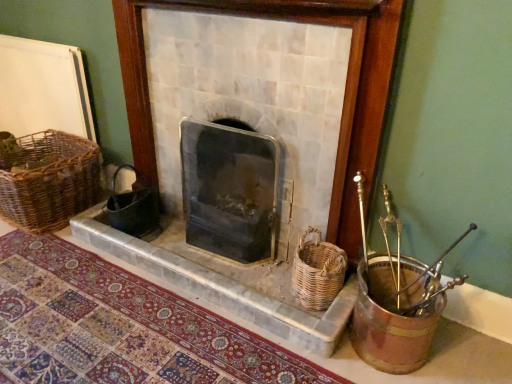
What do you see at coordinates (151, 311) in the screenshot? The height and width of the screenshot is (384, 512). I see `patterned carpet at lower left` at bounding box center [151, 311].

The height and width of the screenshot is (384, 512). What do you see at coordinates (344, 96) in the screenshot?
I see `white marble fireplace at center` at bounding box center [344, 96].

Where is `white marble fireplace at center`? white marble fireplace at center is located at coordinates (344, 96).

The image size is (512, 384). Describe the element at coordinates (229, 191) in the screenshot. I see `black glass wood burning stove at center` at that location.

Locate an element on the screen. Image resolution: width=512 pixels, height=384 pixels. patterned carpet at lower left is located at coordinates (151, 311).

From the image's perspective, which is above, white marble fireplace at center or patterned carpet at lower left?

From the image's view, white marble fireplace at center is above.

Which object is positioned more to the right, white marble fireplace at center or patterned carpet at lower left?

From the viewer's perspective, white marble fireplace at center appears more on the right side.

From a real-world perspective, is white marble fireplace at center positioned under patterned carpet at lower left based on gravity?

No, from a real-world perspective, white marble fireplace at center is not under patterned carpet at lower left.

Considering the sizes of objects white marble fireplace at center and woven brown basket at left, which appears as the 2th basket when viewed from the right, in the image provided, who is thinner, white marble fireplace at center or woven brown basket at left, which appears as the 2th basket when viewed from the right,?

white marble fireplace at center.

Considering the sizes of objects white marble fireplace at center and woven brown basket at left, which appears as the 2th basket when viewed from the right, in the image provided, who is shorter, white marble fireplace at center or woven brown basket at left, which appears as the 2th basket when viewed from the right,?

woven brown basket at left, which appears as the 2th basket when viewed from the right, is shorter.

Is white marble fireplace at center positioned with its back to woven brown basket at left, which appears as the 2th basket when viewed from the right?

No, white marble fireplace at center is not facing the opposite direction of woven brown basket at left, which appears as the 2th basket when viewed from the right.

Looking at this image, does woven brown basket at left, which appears as the 2th basket when viewed from the right, turn towards patterned carpet at lower left?

No, woven brown basket at left, which appears as the 2th basket when viewed from the right, is not oriented towards patterned carpet at lower left.

This screenshot has width=512, height=384. Identify the location of basket that is the 2nd object located above the patterned carpet at lower left (from the image's perspective). (51, 181).

Based on the photo, considering their positions, is woven brown basket at left, marked as the first basket in a back-to-front arrangement, located in front of or behind patterned carpet at lower left?

In the image, woven brown basket at left, marked as the first basket in a back-to-front arrangement, appears behind patterned carpet at lower left.

Which object is further away from the camera taking this photo, white marble fireplace at center or black glass wood burning stove at center?

black glass wood burning stove at center is behind.

From a real-world perspective, is white marble fireplace at center physically located above or below black glass wood burning stove at center?

Clearly, from a real-world perspective, white marble fireplace at center is above black glass wood burning stove at center.

Is white marble fireplace at center aimed at black glass wood burning stove at center?

Yes, white marble fireplace at center is turned towards black glass wood burning stove at center.

From the image's perspective, is white marble fireplace at center over black glass wood burning stove at center?

Yes, from the image's perspective, white marble fireplace at center is on top of black glass wood burning stove at center.

Between point (72, 310) and point (367, 94), which one is positioned in front?

Positioned in front is point (367, 94).

Which is behind, patterned carpet at lower left or white marble fireplace at center?

white marble fireplace at center is behind.

From a real-world perspective, which is physically below, patterned carpet at lower left or white marble fireplace at center?

A: patterned carpet at lower left is physically lower.

From a real-world perspective, is patterned carpet at lower left physically located above or below black glass wood burning stove at center?

From a real-world perspective, patterned carpet at lower left is physically below black glass wood burning stove at center.

Is patterned carpet at lower left bigger than black glass wood burning stove at center?

Incorrect, patterned carpet at lower left is not larger than black glass wood burning stove at center.

Would you consider patterned carpet at lower left to be distant from black glass wood burning stove at center?

No, patterned carpet at lower left is in close proximity to black glass wood burning stove at center.

From the picture: Is patterned carpet at lower left facing away from black glass wood burning stove at center?

No, patterned carpet at lower left is not facing away from black glass wood burning stove at center.

Can you tell me how much black glass wood burning stove at center and white marble fireplace at center differ in facing direction?

They differ by 0.0011 degrees in their facing directions.

Which object is positioned more to the left, black glass wood burning stove at center or white marble fireplace at center?

From the viewer's perspective, black glass wood burning stove at center appears more on the left side.

Measure the distance from black glass wood burning stove at center to white marble fireplace at center.

black glass wood burning stove at center and white marble fireplace at center are 13.05 inches apart.

Which is behind, black glass wood burning stove at center or white marble fireplace at center?

black glass wood burning stove at center is more distant.

Locate an element on the screen. fireplace lying behind the patterned carpet at lower left is located at coordinates (344, 96).

Find the location of `fireplace in front of the woven brown basket at left, which appears as the 2th basket when viewed from the right`. fireplace in front of the woven brown basket at left, which appears as the 2th basket when viewed from the right is located at coordinates (344, 96).

From the image, which object appears to be nearer to white marble fireplace at center, black wicker gift basket at center or patterned carpet at lower left?

patterned carpet at lower left lies closer to white marble fireplace at center than the other object.

In the scene shown: Based on their spatial positions, is woven brown basket at left, the second basket from the front, or black glass wood burning stove at center further from white marble fireplace at center?

woven brown basket at left, the second basket from the front, is positioned further to the anchor white marble fireplace at center.

Based on the photo, looking at the image, which one is located closer to black wicker gift basket at center, patterned carpet at lower left or woven brown basket at lower right, acting as the 1th basket starting from the front?

Among the two, patterned carpet at lower left is located nearer to black wicker gift basket at center.

Considering their positions, is white marble fireplace at center positioned closer to patterned carpet at lower left than black wicker gift basket at center?

The object closer to patterned carpet at lower left is white marble fireplace at center.

When comparing their distances from woven brown basket at lower right, marked as the 1th basket in a right-to-left arrangement, does white marble fireplace at center or black wicker gift basket at center seem further?

black wicker gift basket at center lies further to woven brown basket at lower right, marked as the 1th basket in a right-to-left arrangement, than the other object.

From the image, which object appears to be farther from white marble fireplace at center, woven brown basket at lower right, arranged as the 2th basket when viewed from the back, or woven brown basket at left, the second basket from the front?

woven brown basket at left, the second basket from the front, lies further to white marble fireplace at center than the other object.

Based on their spatial positions, is patterned carpet at lower left or woven brown basket at left, marked as the first basket in a back-to-front arrangement, closer to black glass wood burning stove at center?

patterned carpet at lower left is positioned closer to the anchor black glass wood burning stove at center.

Based on their spatial positions, is black glass wood burning stove at center or white marble fireplace at center further from woven brown basket at lower right, arranged as the 2th basket when viewed from the back?

black glass wood burning stove at center.

The width and height of the screenshot is (512, 384). I want to click on wood burning stove between woven brown basket at left, which is the first basket in left-to-right order, and white marble fireplace at center, so click(x=229, y=191).

The image size is (512, 384). Find the location of `gift basket between woven brown basket at left, which appears as the 2th basket when viewed from the right, and black glass wood burning stove at center from left to right`. gift basket between woven brown basket at left, which appears as the 2th basket when viewed from the right, and black glass wood burning stove at center from left to right is located at coordinates (134, 208).

The image size is (512, 384). I want to click on fireplace between patterned carpet at lower left and black wicker gift basket at center from front to back, so click(344, 96).

This screenshot has width=512, height=384. I want to click on wood burning stove between woven brown basket at left, which appears as the 2th basket when viewed from the right, and woven brown basket at lower right, acting as the 1th basket starting from the front, from left to right, so click(x=229, y=191).